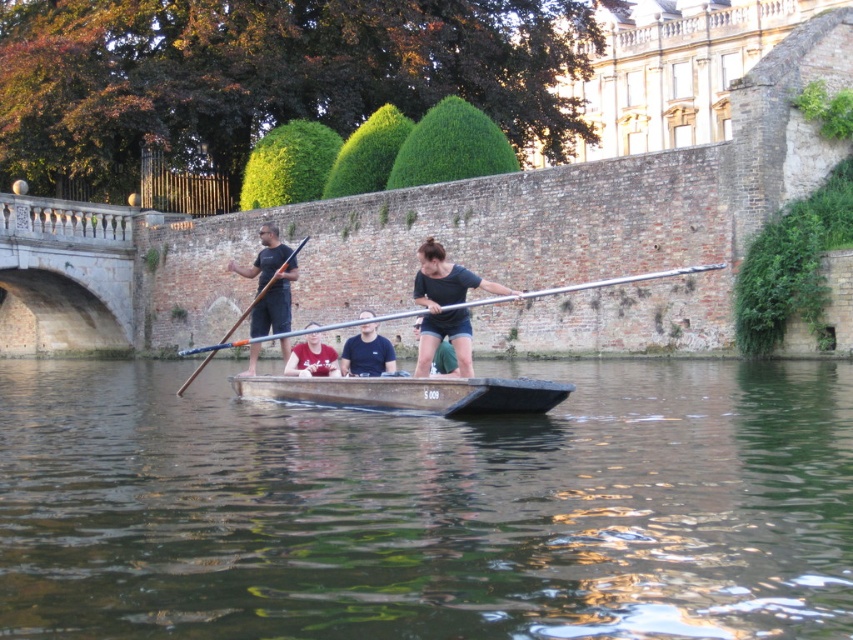
Question: Considering the relative positions of matte red shirt at center and orange wood paddle at center in the image provided, where is matte red shirt at center located with respect to orange wood paddle at center?

Choices:
 (A) right
 (B) left

Answer: (A)

Question: From the image, what is the correct spatial relationship of wooden canoe at center in relation to matte black shirt at center?

Choices:
 (A) left
 (B) right

Answer: (A)

Question: Which point appears farthest from the camera in this image?

Choices:
 (A) (426, 540)
 (B) (553, 388)
 (C) (254, 304)

Answer: (C)

Question: Among these points, which one is farthest from the camera?

Choices:
 (A) (462, 317)
 (B) (692, 534)

Answer: (A)

Question: Which point appears closest to the camera in this image?

Choices:
 (A) (357, 358)
 (B) (283, 282)
 (C) (500, 301)

Answer: (A)

Question: Can you confirm if wooden canoe at center is wider than silver metallic paddle at center?

Choices:
 (A) no
 (B) yes

Answer: (A)